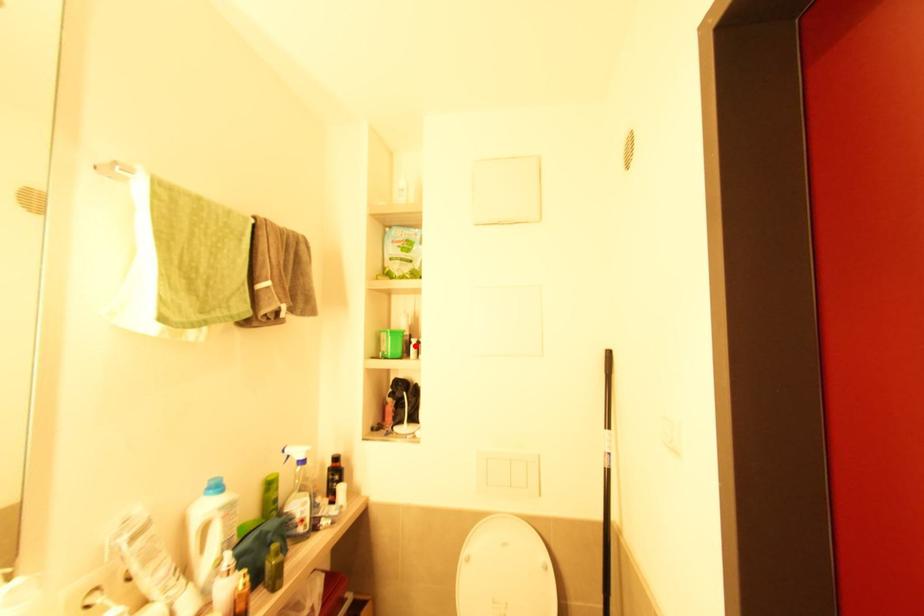
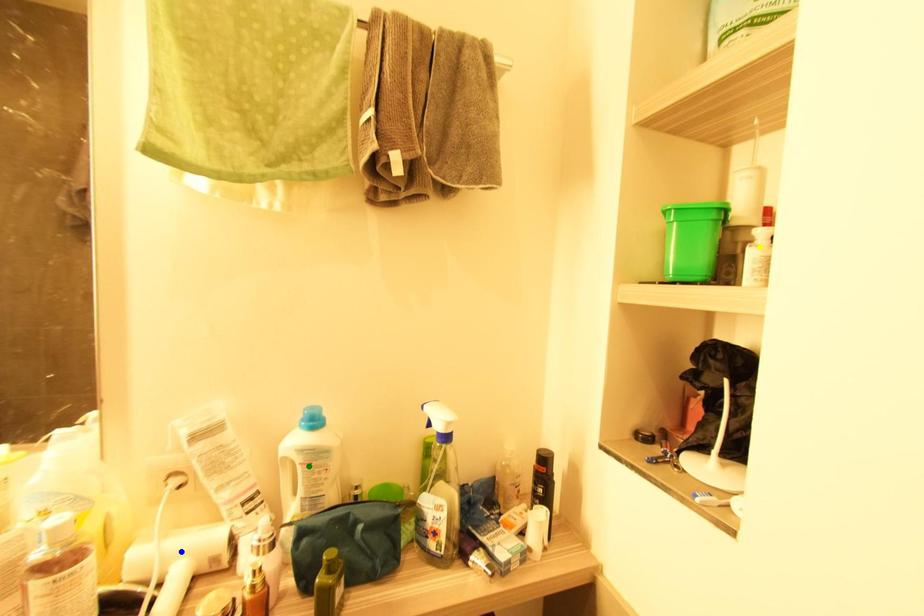
Question: I am providing you with two images of the same scene from different viewpoints. A red point is marked on the first image. You are given multiple points on the second image. In image 2, which mark is for the same physical point as the one in image 1?

Choices:
 (A) green point
 (B) yellow point
 (C) blue point

Answer: (B)